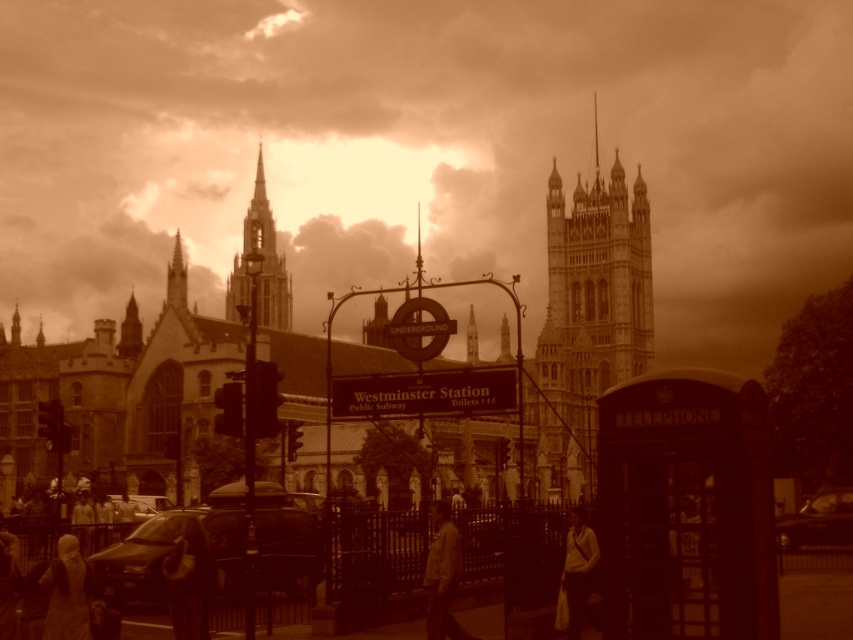
You are a tourist in London holding a matte beige coat at lower left and looking at the Westminster Station sign. You notice a matte stone tower at upper left in the background. Which object is wider?

The matte stone tower at upper left is wider than the matte beige coat at lower left.

You are an architect analyzing the layout of this historical site. The scene includes a matte stone tower at upper left. Can you determine its exact coordinates in the image?

The matte stone tower at upper left is located at coordinates point (260, 266).

You are a fashion designer observing a vintage London Underground scene. You notice a brown leather jacket at center and a matte beige coat at lower left. Which clothing item is located to the right of the other?

The brown leather jacket at center is positioned on the right side of matte beige coat at lower left.